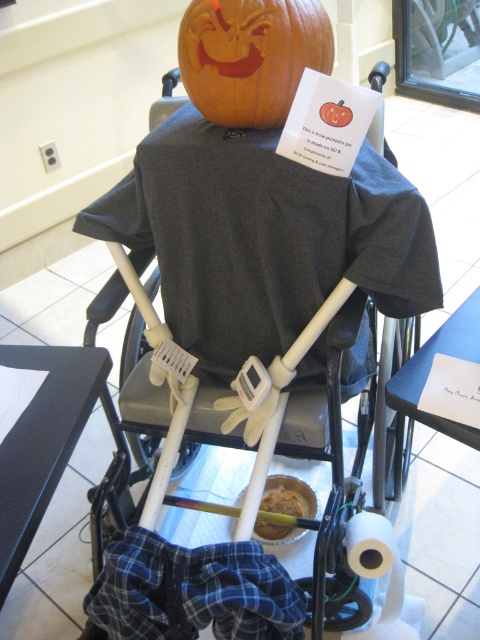
Question: Is orange carved pumpkin at upper center above golden brown bread at center?

Choices:
 (A) no
 (B) yes

Answer: (B)

Question: Which of the following is the closest to the observer?

Choices:
 (A) blue flannel pants at lower center
 (B) white plastic baby carriage at center
 (C) white matte toilet paper at lower center

Answer: (A)

Question: Does orange carved pumpkin at upper center have a smaller size compared to white matte toilet paper at lower center?

Choices:
 (A) yes
 (B) no

Answer: (B)

Question: Is the position of white plastic baby carriage at center less distant than that of golden brown bread at center?

Choices:
 (A) yes
 (B) no

Answer: (A)

Question: Which is farther from the white plastic baby carriage at center?

Choices:
 (A) golden brown bread at center
 (B) white matte toilet paper at lower center
 (C) orange carved pumpkin at upper center
 (D) blue flannel pants at lower center

Answer: (A)

Question: Among these objects, which one is farthest from the camera?

Choices:
 (A) white matte toilet paper at lower center
 (B) white plastic baby carriage at center
 (C) orange carved pumpkin at upper center

Answer: (A)